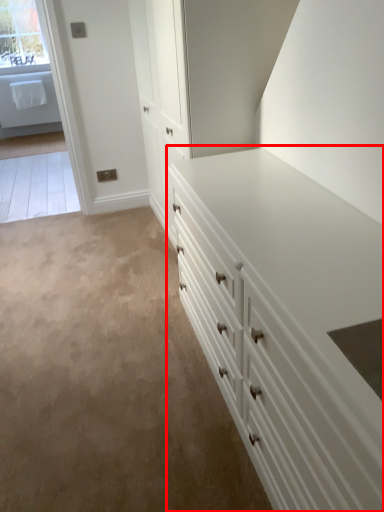
Question: From the image's perspective, considering the relative positions of chest of drawers (annotated by the red box) and window in the image provided, where is chest of drawers (annotated by the red box) located with respect to the staircase?

Choices:
 (A) above
 (B) below

Answer: (B)